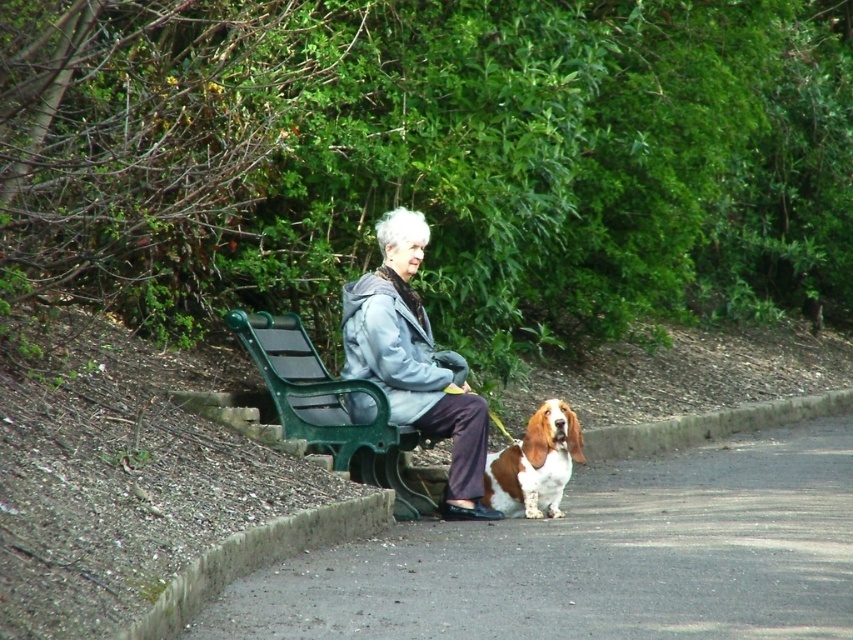
Can you confirm if smooth asphalt road at lower center is wider than green plastic bench at center?

In fact, smooth asphalt road at lower center might be narrower than green plastic bench at center.

At what (x,y) coordinates should I click in order to perform the action: click on smooth asphalt road at lower center. Please return your answer as a coordinate pair (x, y). Looking at the image, I should click on (595, 557).

Identify the location of smooth asphalt road at lower center. Image resolution: width=853 pixels, height=640 pixels. (595, 557).

Is gray fleece jacket at center positioned behind brown and white fur at lower center?

No, gray fleece jacket at center is in front of brown and white fur at lower center.

Between gray fleece jacket at center and brown and white fur at lower center, which one appears on the left side from the viewer's perspective?

gray fleece jacket at center is more to the left.

What do you see at coordinates (413, 360) in the screenshot? This screenshot has height=640, width=853. I see `gray fleece jacket at center` at bounding box center [413, 360].

This screenshot has height=640, width=853. Identify the location of gray fleece jacket at center. (413, 360).

Is point (270, 364) closer to viewer compared to point (538, 408)?

Yes.

Describe the element at coordinates (328, 406) in the screenshot. I see `green plastic bench at center` at that location.

The image size is (853, 640). In order to click on green plastic bench at center in this screenshot , I will do `click(328, 406)`.